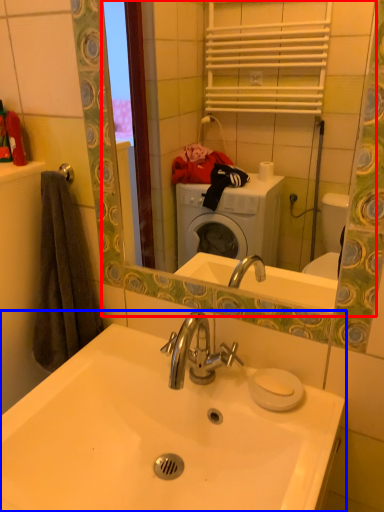
Question: Among these objects, which one is farthest to the camera, mirror (highlighted by a red box) or sink (highlighted by a blue box)?

Choices:
 (A) mirror
 (B) sink

Answer: (A)